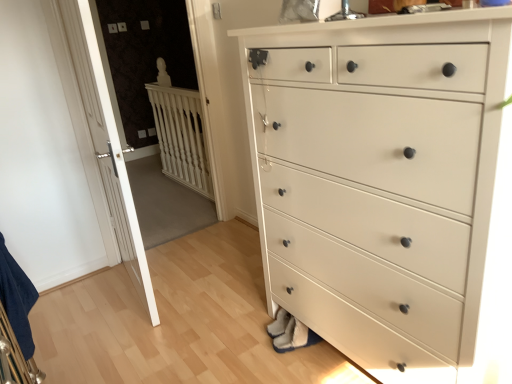
What do you see at coordinates (103, 141) in the screenshot?
I see `white wooden door at left` at bounding box center [103, 141].

Describe the element at coordinates (381, 179) in the screenshot. I see `white painted wood chest of drawers at center` at that location.

At what (x,y) coordinates should I click in order to perform the action: click on white wood balustrade at upper left. Please return your answer as a coordinate pair (x, y). This screenshot has width=512, height=384. Looking at the image, I should click on (180, 133).

Is white wooden door at left shorter than white wood balustrade at upper left?

No.

Locate an element on the screen. balustrade that appears behind the white wooden door at left is located at coordinates click(x=180, y=133).

From the image's perspective, between white wooden door at left and white wood balustrade at upper left, which one is located above?

From the image's view, white wood balustrade at upper left is above.

Which of these two, white wood balustrade at upper left or white painted wood chest of drawers at center, is thinner?

white wood balustrade at upper left.

Which object is more forward, white wood balustrade at upper left or white painted wood chest of drawers at center?

white painted wood chest of drawers at center is more forward.

Is white wood balustrade at upper left aimed at white painted wood chest of drawers at center?

No, white wood balustrade at upper left is not turned towards white painted wood chest of drawers at center.

Could you measure the distance between white wood balustrade at upper left and white painted wood chest of drawers at center?

white wood balustrade at upper left is 6.79 feet from white painted wood chest of drawers at center.

How different are the orientations of white painted wood chest of drawers at center and white wooden door at left in degrees?

174 degrees.

Locate an element on the screen. The height and width of the screenshot is (384, 512). chest of drawers below the white wooden door at left (from a real-world perspective) is located at coordinates pyautogui.click(x=381, y=179).

Can you confirm if white painted wood chest of drawers at center is smaller than white wooden door at left?

Actually, white painted wood chest of drawers at center might be larger than white wooden door at left.

Is white wooden door at left inside the boundaries of white painted wood chest of drawers at center, or outside?

white wooden door at left is not enclosed by white painted wood chest of drawers at center.

Does white wooden door at left have a greater height compared to white painted wood chest of drawers at center?

Yes.

Which of these two, white wooden door at left or white painted wood chest of drawers at center, is thinner?

Thinner between the two is white wooden door at left.

Can you see white painted wood chest of drawers at center touching white wood balustrade at upper left?

They are not placed beside each other.

Is white painted wood chest of drawers at center facing towards white wood balustrade at upper left?

No, white painted wood chest of drawers at center is not aimed at white wood balustrade at upper left.

Is point (474, 179) closer to viewer compared to point (202, 143)?

Yes, point (474, 179) is closer to viewer.

Is white wood balustrade at upper left located within white painted wood chest of drawers at center?

Definitely not — white wood balustrade at upper left is not inside white painted wood chest of drawers at center.

From a real-world perspective, between white wood balustrade at upper left and white wooden door at left, who is vertically lower?

From a 3D spatial view, white wood balustrade at upper left is below.

Considering the positions of points (202, 175) and (98, 134), is point (202, 175) farther from camera compared to point (98, 134)?

Yes, point (202, 175) is behind point (98, 134).

Looking at the image, does white wood balustrade at upper left seem bigger or smaller compared to white wooden door at left?

Clearly, white wood balustrade at upper left is smaller in size than white wooden door at left.

Is white wood balustrade at upper left turned away from white wooden door at left?

No, white wooden door at left is not at the back of white wood balustrade at upper left.

Image resolution: width=512 pixels, height=384 pixels. In order to click on door below the white wood balustrade at upper left (from the image's perspective) in this screenshot , I will do `click(103, 141)`.

Identify the location of the chest of drawers positioned vertically above the white wood balustrade at upper left (from a real-world perspective). The height and width of the screenshot is (384, 512). (381, 179).

Which object lies nearer to the anchor point white painted wood chest of drawers at center, white wood balustrade at upper left or white wooden door at left?

The object closer to white painted wood chest of drawers at center is white wooden door at left.

When comparing their distances from white wood balustrade at upper left, does white painted wood chest of drawers at center or white wooden door at left seem further?

Based on the image, white painted wood chest of drawers at center appears to be further to white wood balustrade at upper left.

Which object lies further to the anchor point white wooden door at left, white painted wood chest of drawers at center or white wood balustrade at upper left?

white wood balustrade at upper left is further to white wooden door at left.

From the image, which object appears to be farther from white painted wood chest of drawers at center, white wooden door at left or white wood balustrade at upper left?

white wood balustrade at upper left.

Looking at the image, which one is located further to white wooden door at left, white wood balustrade at upper left or white painted wood chest of drawers at center?

white wood balustrade at upper left lies further to white wooden door at left than the other object.

Looking at the image, which one is located further to white wood balustrade at upper left, white wooden door at left or white painted wood chest of drawers at center?

white painted wood chest of drawers at center lies further to white wood balustrade at upper left than the other object.

At what (x,y) coordinates should I click in order to perform the action: click on door between white painted wood chest of drawers at center and white wood balustrade at upper left in the front-back direction. Please return your answer as a coordinate pair (x, y). Looking at the image, I should click on (103, 141).